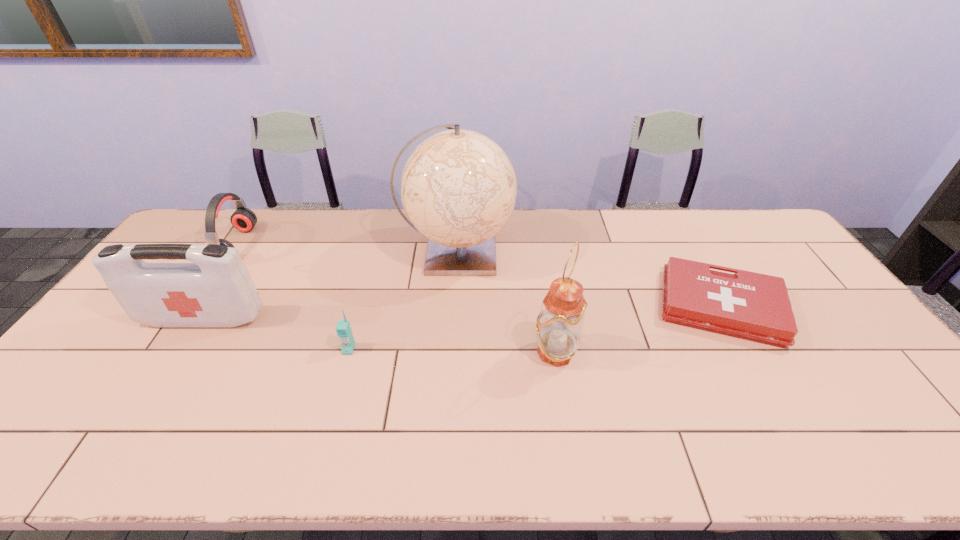
Identify the location of the rightmost object. (747, 305).

Find the location of a particular element. This screenshot has width=960, height=540. vacant area situated on the surface of the globe showing Europe and Africa is located at coordinates (602, 253).

In order to click on free spot located 0.140m on the left of the fifth shortest object in this screenshot , I will do `click(480, 352)`.

In order to click on vacant space positioned on the front side of the left first-aid kit in this screenshot , I will do `click(132, 432)`.

You are a GUI agent. You are given a task and a screenshot of the screen. Output one action in this format:
    pyautogui.click(x=<x>, y=<y>)
    Task: Click on the vacant space located on the ear cups of the earphone
    
    Given the screenshot: What is the action you would take?
    pyautogui.click(x=275, y=245)

The width and height of the screenshot is (960, 540). In order to click on free region located on the keypad of the fifth tallest object in this screenshot , I will do `click(321, 449)`.

Locate an element on the screen. blank space located on the back of the shorter first-aid kit is located at coordinates (680, 235).

Find the location of a particular element. globe present at the far edge is located at coordinates (458, 187).

This screenshot has height=540, width=960. I want to click on earphone that is at the far edge, so click(x=243, y=219).

Locate an element on the screen. object that is at the left edge is located at coordinates (217, 290).